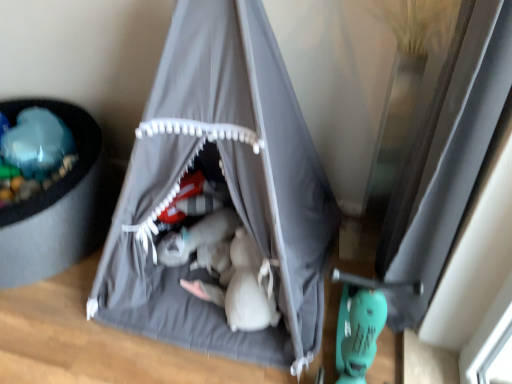
I want to click on gray fabric tent at center, so click(229, 188).

The width and height of the screenshot is (512, 384). Describe the element at coordinates (229, 188) in the screenshot. I see `gray fabric tent at center` at that location.

The width and height of the screenshot is (512, 384). What do you see at coordinates (457, 195) in the screenshot? I see `transparent glass window at right` at bounding box center [457, 195].

This screenshot has width=512, height=384. In order to click on transparent glass window at right in this screenshot , I will do `click(457, 195)`.

This screenshot has height=384, width=512. What are the coordinates of `gray fabric tent at center` in the screenshot? It's located at (229, 188).

Based on their positions, is transparent glass window at right located to the left or right of gray fabric tent at center?

From the image, it's evident that transparent glass window at right is to the right of gray fabric tent at center.

Is transparent glass window at right in front of or behind gray fabric tent at center in the image?

transparent glass window at right is behind gray fabric tent at center.

Which point is more distant from viewer, (500, 317) or (164, 49)?

Point (164, 49)

From the image's perspective, which is below, transparent glass window at right or gray fabric tent at center?

transparent glass window at right appears lower in the image.

From a real-world perspective, is transparent glass window at right above or below gray fabric tent at center?

transparent glass window at right is below gray fabric tent at center.

Considering the sizes of objects transparent glass window at right and gray fabric tent at center in the image provided, who is thinner, transparent glass window at right or gray fabric tent at center?

transparent glass window at right.

Considering the relative sizes of transparent glass window at right and gray fabric tent at center in the image provided, is transparent glass window at right shorter than gray fabric tent at center?

Yes.

Considering the sizes of objects transparent glass window at right and gray fabric tent at center in the image provided, who is bigger, transparent glass window at right or gray fabric tent at center?

Bigger between the two is gray fabric tent at center.

Is transparent glass window at right located outside gray fabric tent at center?

transparent glass window at right lies outside gray fabric tent at center's area.

Is the surface of transparent glass window at right in direct contact with gray fabric tent at center?

No, transparent glass window at right is not next to gray fabric tent at center.

Is transparent glass window at right oriented towards gray fabric tent at center?

Yes, transparent glass window at right is turned towards gray fabric tent at center.

In the scene shown: What's the angular difference between transparent glass window at right and gray fabric tent at center's facing directions?

There is a 87.9-degree angle between the facing directions of transparent glass window at right and gray fabric tent at center.

I want to click on tent that appears on the left of transparent glass window at right, so [x=229, y=188].

Between gray fabric tent at center and transparent glass window at right, which one appears on the left side from the viewer's perspective?

gray fabric tent at center is more to the left.

Who is more distant, gray fabric tent at center or transparent glass window at right?

transparent glass window at right is further away from the camera.

Which is nearer, (278, 230) or (472, 133)?

The point (472, 133) is more forward.

From the image's perspective, is gray fabric tent at center on transparent glass window at right?

Yes, from the image's perspective, gray fabric tent at center is above transparent glass window at right.

From a real-world perspective, between gray fabric tent at center and transparent glass window at right, who is vertically lower?

transparent glass window at right.

Looking at their sizes, would you say gray fabric tent at center is wider or thinner than transparent glass window at right?

gray fabric tent at center is wider than transparent glass window at right.

Considering the relative sizes of gray fabric tent at center and transparent glass window at right in the image provided, is gray fabric tent at center shorter than transparent glass window at right?

No, gray fabric tent at center is not shorter than transparent glass window at right.

In terms of size, does gray fabric tent at center appear bigger or smaller than transparent glass window at right?

Considering their sizes, gray fabric tent at center takes up more space than transparent glass window at right.

Do you think gray fabric tent at center is within transparent glass window at right, or outside of it?

gray fabric tent at center is located beyond the bounds of transparent glass window at right.

Can you see gray fabric tent at center touching transparent glass window at right?

They are not placed beside each other.

Is gray fabric tent at center oriented towards transparent glass window at right?

No, gray fabric tent at center is not facing towards transparent glass window at right.

What's the angular difference between gray fabric tent at center and transparent glass window at right's facing directions?

The angle between the facing direction of gray fabric tent at center and the facing direction of transparent glass window at right is 87.9 degrees.

Where is `tent above the transparent glass window at right (from the image's perspective)`? The image size is (512, 384). tent above the transparent glass window at right (from the image's perspective) is located at coordinates (229, 188).

Where is `tent above the transparent glass window at right (from the image's perspective)`? Image resolution: width=512 pixels, height=384 pixels. tent above the transparent glass window at right (from the image's perspective) is located at coordinates (229, 188).

Identify the location of window below the gray fabric tent at center (from a real-world perspective). (457, 195).